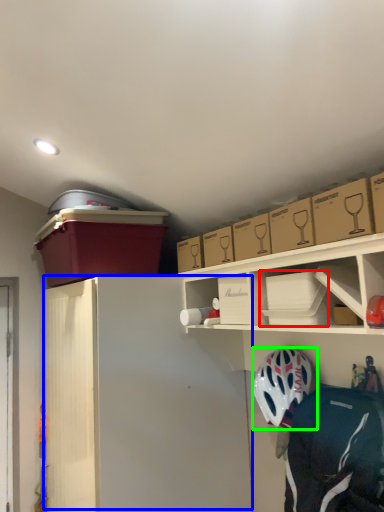
Question: Based on their relative distances, which object is nearer to box (highlighted by a red box)? Choose from wide (highlighted by a blue box) and helmet (highlighted by a green box).

Choices:
 (A) wide
 (B) helmet

Answer: (B)